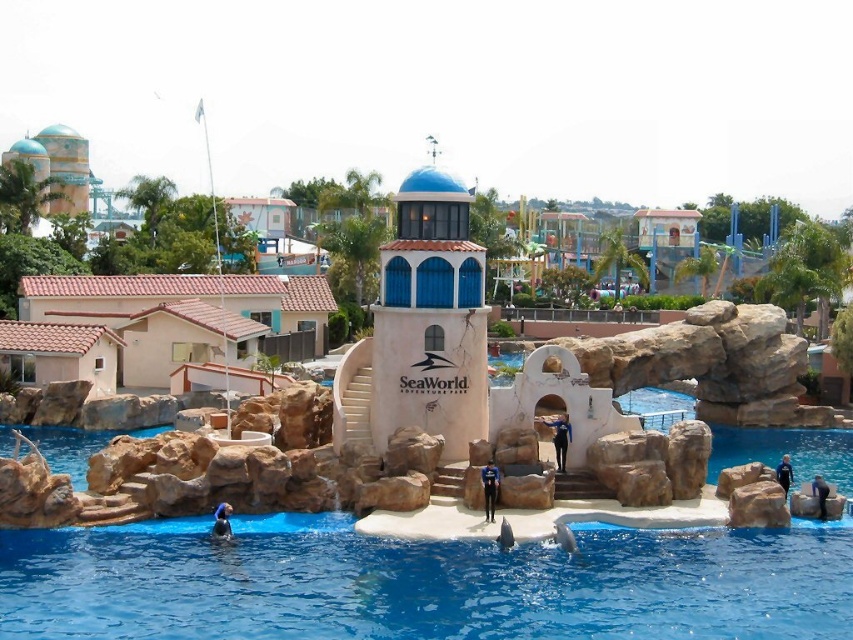
Question: Can you confirm if blue glossy water at lower center is wider than beige tile roof house at left?

Choices:
 (A) no
 (B) yes

Answer: (B)

Question: Among these objects, which one is nearest to the camera?

Choices:
 (A) blue painted concrete tower at center
 (B) blue glossy water at lower center
 (C) beige tile roof house at left

Answer: (B)

Question: Is blue painted concrete tower at center below beige tile roof house at left?

Choices:
 (A) no
 (B) yes

Answer: (A)

Question: Does blue painted concrete tower at center appear over beige tile roof house at left?

Choices:
 (A) yes
 (B) no

Answer: (A)

Question: Among these points, which one is farthest from the camera?

Choices:
 (A) (62, 296)
 (B) (62, 605)

Answer: (A)

Question: Which point is closer to the camera taking this photo?

Choices:
 (A) (422, 237)
 (B) (128, 346)
 (C) (410, 563)

Answer: (C)